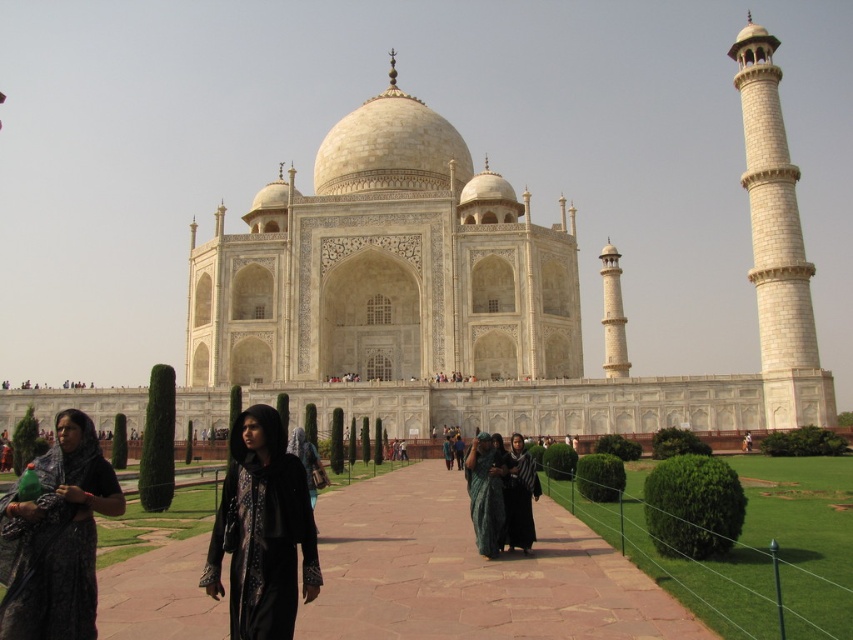
Question: Can you confirm if black lace dress at lower left is wider than dark gray fabric at center?

Choices:
 (A) yes
 (B) no

Answer: (A)

Question: Among these points, which one is farthest from the camera?

Choices:
 (A) (469, 477)
 (B) (532, 490)
 (C) (291, 604)
 (D) (550, 524)

Answer: (D)

Question: Which object is positioned farthest from the dark gray fabric at center?

Choices:
 (A) black velvet dress at center
 (B) black lace dress at lower left
 (C) dark green fabric at center

Answer: (B)

Question: Estimate the real-world distances between objects in this image. Which object is farther from the black velvet dress at center?

Choices:
 (A) black lace dress at lower left
 (B) dark gray fabric at center

Answer: (B)

Question: Observing the image, what is the correct spatial positioning of black lace dress at lower left in reference to dark gray fabric at center?

Choices:
 (A) left
 (B) right

Answer: (A)

Question: Observing the image, what is the correct spatial positioning of brown stone pathway at center in reference to dark gray fabric at center?

Choices:
 (A) above
 (B) below

Answer: (B)